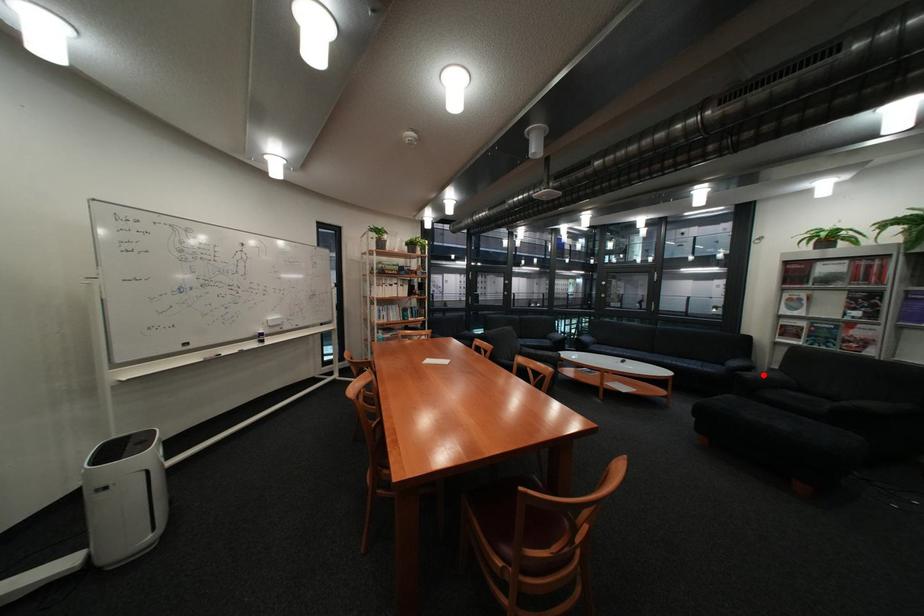
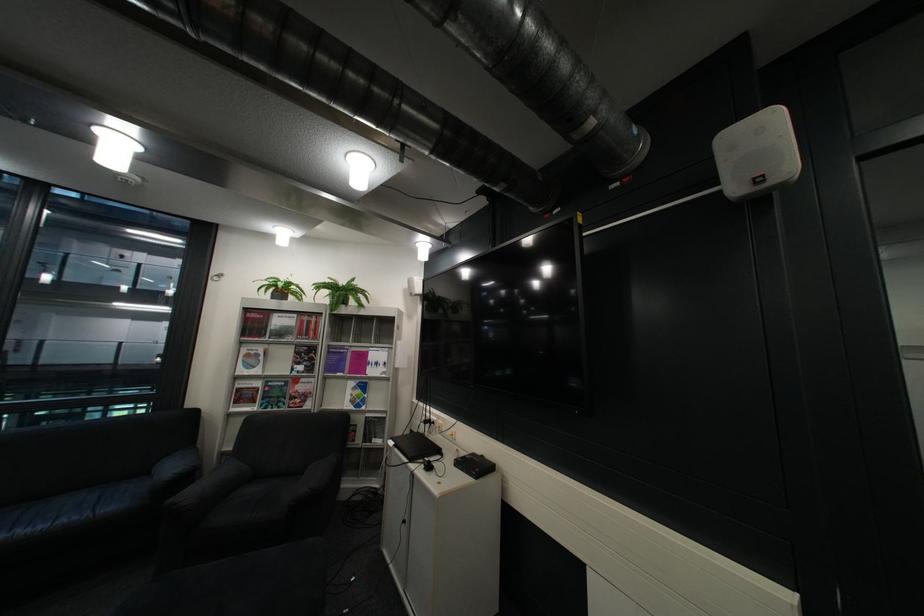
In the second image, find the point that corresponds to the highlighted location in the first image.

(204, 495)